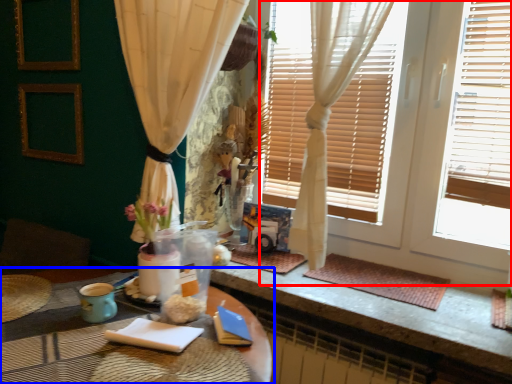
Question: Which object is closer to the camera taking this photo, window frame (highlighted by a red box) or table (highlighted by a blue box)?

Choices:
 (A) window frame
 (B) table

Answer: (B)